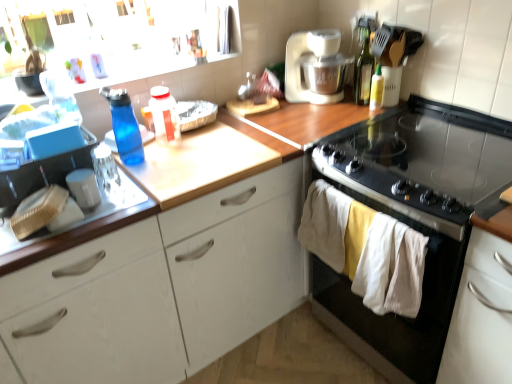
Find the location of a particular element. vacant space positioned to the left of yellow matte bottle at upper right, the 1th bottle in the right-to-left sequence is located at coordinates (342, 112).